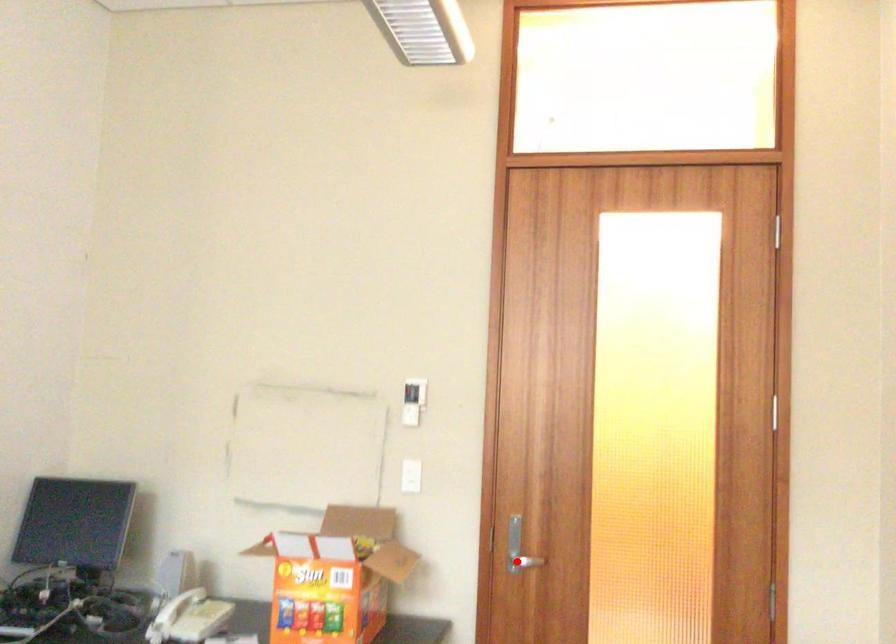
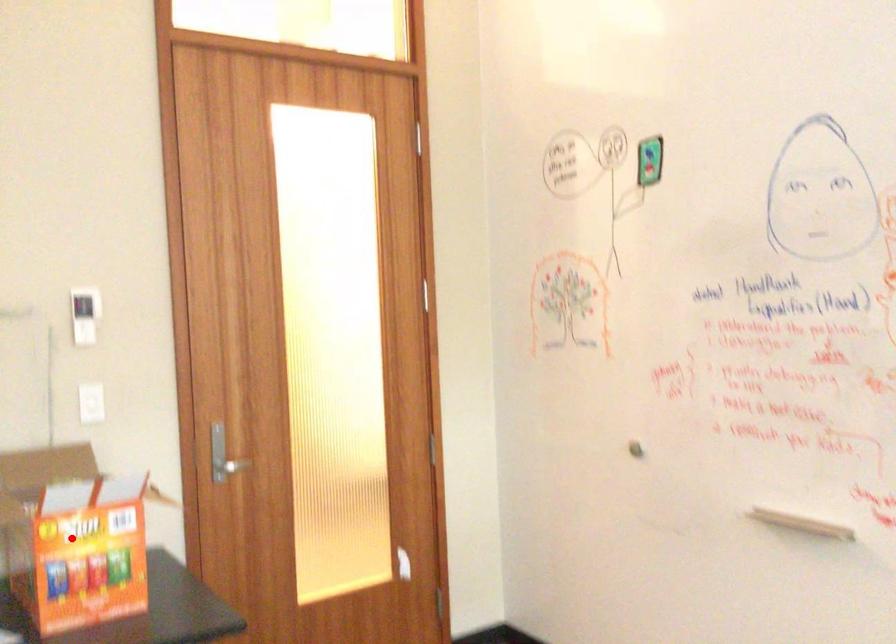
I am providing you with two images of the same scene from different viewpoints. A red point is marked on the first image and another point is marked on the second image. Do the highlighted points in image1 and image2 indicate the same real-world spot?

No